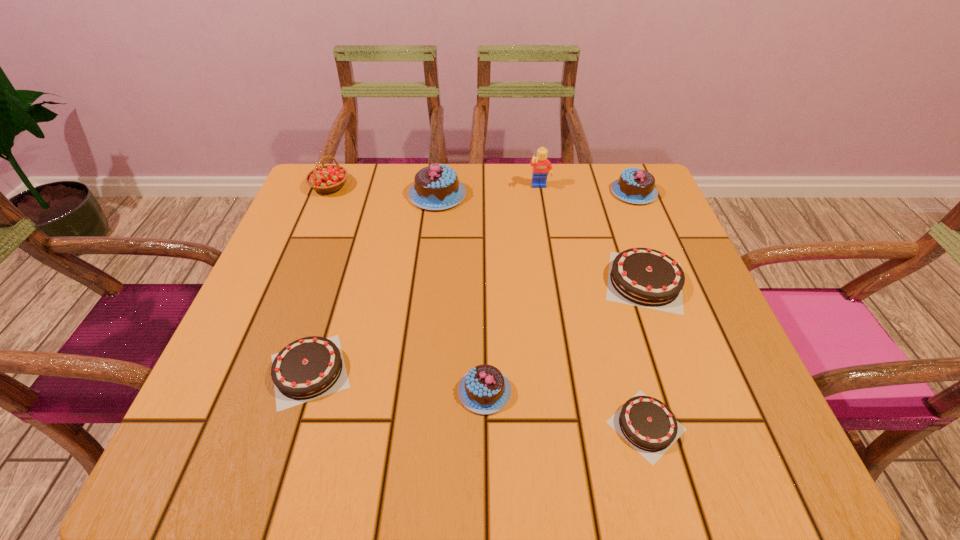
Select which pink chocolate cake appears as the second closest to the smallest pink chocolate cake. Please provide its 2D coordinates. Your answer should be formatted as a tuple, i.e. [(x, y)], where the tuple contains the x and y coordinates of a point satisfying the conditions above.

[(637, 186)]

The image size is (960, 540). Identify the location of brown chocolate cake that is the third closest to the fourth object from right to left. (311, 367).

Choose which brown chocolate cake is the second nearest neighbor to the tallest chocolate cake. Please provide its 2D coordinates. Your answer should be formatted as a tuple, i.e. [(x, y)], where the tuple contains the x and y coordinates of a point satisfying the conditions above.

[(311, 367)]

This screenshot has height=540, width=960. In order to click on blank space that satisfies the following two spatial constraints: 1. on the back side of the leftmost brown chocolate cake; 2. on the right side of the second biggest pink chocolate cake in this screenshot , I will do `click(365, 192)`.